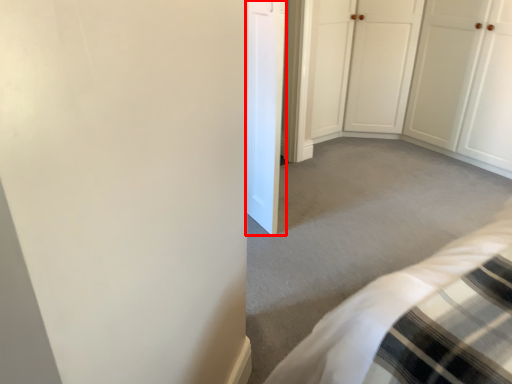
Question: From the image, what is the correct spatial relationship of door (annotated by the red box) in relation to door?

Choices:
 (A) right
 (B) left

Answer: (B)